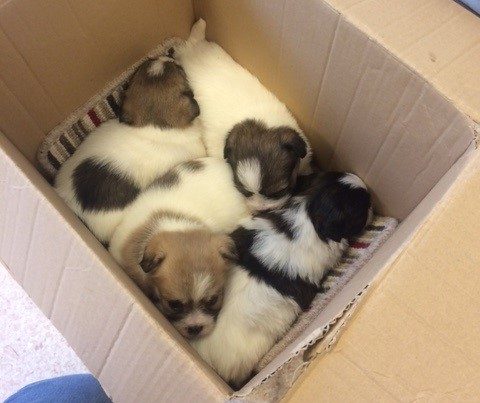
This screenshot has width=480, height=403. I want to click on strpe floor mat, so click(x=97, y=109), click(x=361, y=246).